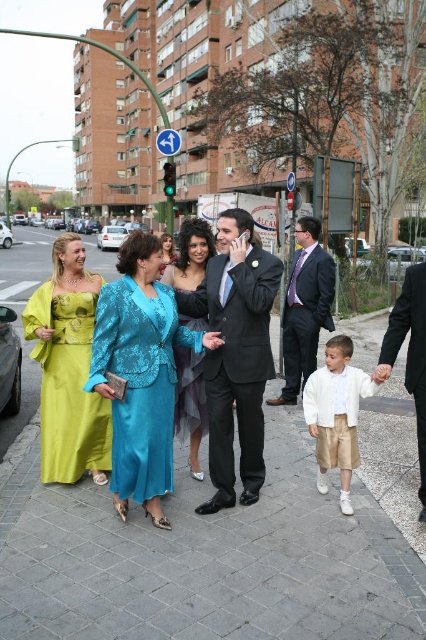
Question: Does white satin shirt at center appear on the right side of black satin suit at right?

Choices:
 (A) no
 (B) yes

Answer: (A)

Question: Which of the following is the farthest from the observer?

Choices:
 (A) pyautogui.click(x=308, y=225)
 (B) pyautogui.click(x=339, y=499)

Answer: (A)

Question: Among these objects, which one is farthest from the camera?

Choices:
 (A) shiny teal dress at center
 (B) black satin suit at right
 (C) shiny blue fabric dress at center
 (D) turquoise satin dress at center

Answer: (C)

Question: Is teal satin dress at center positioned behind shiny teal dress at center?

Choices:
 (A) no
 (B) yes

Answer: (B)

Question: Can you confirm if lime satin dress at left is positioned above shiny blue fabric dress at center?

Choices:
 (A) yes
 (B) no

Answer: (B)

Question: Which of these objects is positioned farthest from the lime satin dress at left?

Choices:
 (A) black satin suit at right
 (B) teal satin dress at center
 (C) matte black suit at center
 (D) satin fabric pavement at center

Answer: (C)